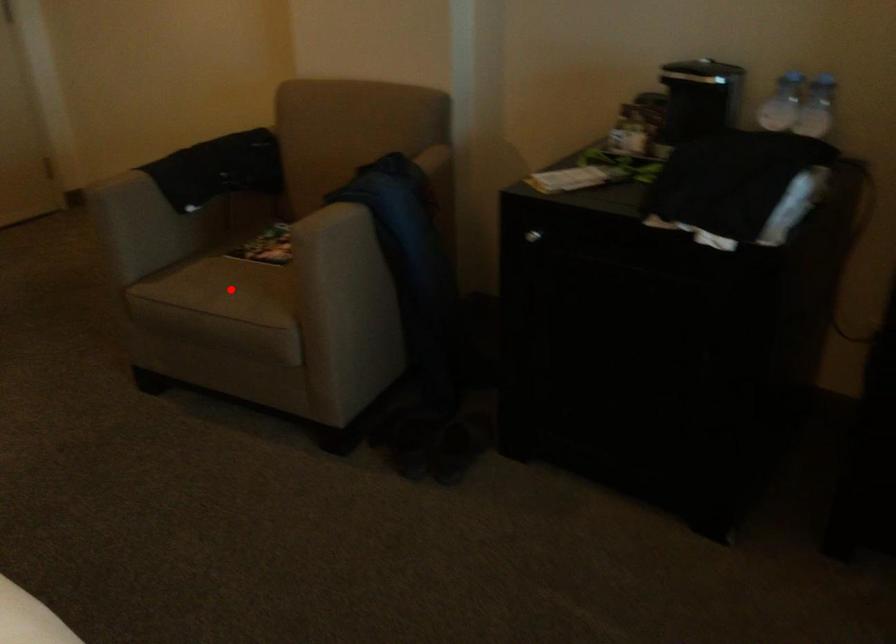
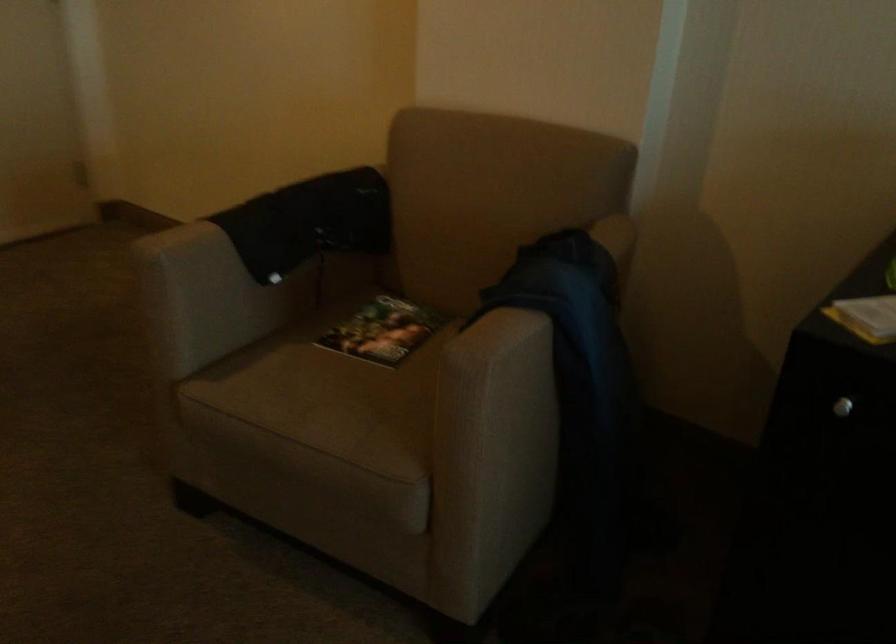
Question: I am providing you with two images of the same scene from different viewpoints. A red point is marked on the first image. Is the red point's position out of view in image 2?

Choices:
 (A) Yes
 (B) No

Answer: (B)